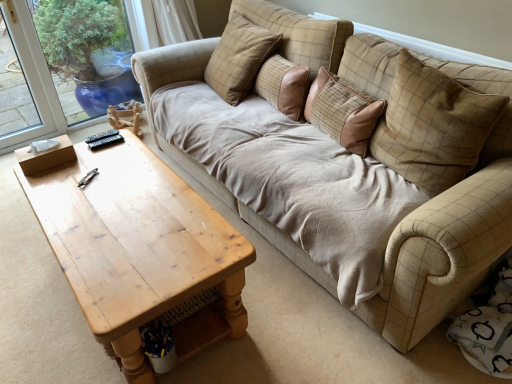
Question: Is beige fabric couch at center with beige checkered pillow at upper center, marked as the fourth pillow in a right-to-left arrangement?

Choices:
 (A) no
 (B) yes

Answer: (A)

Question: Considering the relative sizes of beige fabric couch at center and beige checkered pillow at upper center, marked as the fourth pillow in a right-to-left arrangement, in the image provided, is beige fabric couch at center wider than beige checkered pillow at upper center, marked as the fourth pillow in a right-to-left arrangement,?

Choices:
 (A) yes
 (B) no

Answer: (A)

Question: Could beige checkered pillow at upper center, marked as the fourth pillow in a right-to-left arrangement, be considered to be inside beige fabric couch at center?

Choices:
 (A) no
 (B) yes

Answer: (A)

Question: Does beige fabric couch at center have a smaller size compared to beige checkered pillow at upper center, marked as the fourth pillow in a right-to-left arrangement?

Choices:
 (A) no
 (B) yes

Answer: (A)

Question: Is beige fabric couch at center at the right side of beige checkered pillow at upper center, which ranks as the first pillow in left-to-right order?

Choices:
 (A) yes
 (B) no

Answer: (B)

Question: Considering the relative sizes of beige fabric couch at center and beige checkered pillow at upper center, which ranks as the first pillow in left-to-right order, in the image provided, is beige fabric couch at center taller than beige checkered pillow at upper center, which ranks as the first pillow in left-to-right order,?

Choices:
 (A) yes
 (B) no

Answer: (B)

Question: Considering the relative sizes of beige checkered pillow at upper center, the third pillow viewed from the left, and brown fabric pillow at center, placed as the 2th pillow when sorted from left to right, in the image provided, is beige checkered pillow at upper center, the third pillow viewed from the left, bigger than brown fabric pillow at center, placed as the 2th pillow when sorted from left to right,?

Choices:
 (A) yes
 (B) no

Answer: (A)

Question: Is beige checkered pillow at upper center, which is the second pillow in right-to-left order, aimed at brown fabric pillow at center, the third pillow viewed from the right?

Choices:
 (A) no
 (B) yes

Answer: (A)

Question: Does beige checkered pillow at upper center, the third pillow viewed from the left, have a lesser width compared to brown fabric pillow at center, the third pillow viewed from the right?

Choices:
 (A) yes
 (B) no

Answer: (B)

Question: Can you confirm if beige checkered pillow at upper center, which is the second pillow in right-to-left order, is shorter than brown fabric pillow at center, placed as the 2th pillow when sorted from left to right?

Choices:
 (A) yes
 (B) no

Answer: (B)

Question: Is beige checkered pillow at upper center, the third pillow viewed from the left, oriented away from brown fabric pillow at center, placed as the 2th pillow when sorted from left to right?

Choices:
 (A) yes
 (B) no

Answer: (B)

Question: Is beige checkered pillow at upper center, the third pillow viewed from the left, far from brown fabric pillow at center, the third pillow viewed from the right?

Choices:
 (A) no
 (B) yes

Answer: (A)

Question: Is brown fabric pillow at center, placed as the 2th pillow when sorted from left to right, to the right of light brown wooden coffee table at left from the viewer's perspective?

Choices:
 (A) no
 (B) yes

Answer: (B)